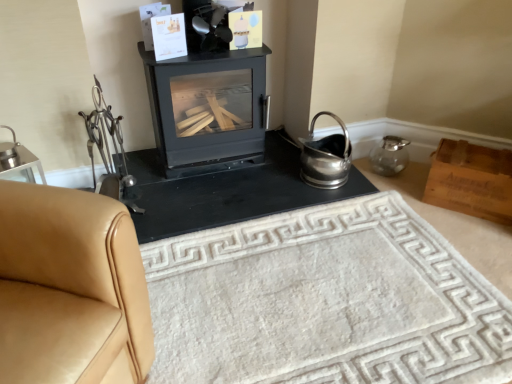
Question: Is white textured rug at center thinner than black matte fireplace at center?

Choices:
 (A) yes
 (B) no

Answer: (B)

Question: Is the depth of white textured rug at center greater than that of black matte fireplace at center?

Choices:
 (A) no
 (B) yes

Answer: (A)

Question: Would you say white textured rug at center contains black matte fireplace at center?

Choices:
 (A) no
 (B) yes

Answer: (A)

Question: From the image's perspective, is white textured rug at center located beneath black matte fireplace at center?

Choices:
 (A) no
 (B) yes

Answer: (B)

Question: From a real-world perspective, is white textured rug at center physically below black matte fireplace at center?

Choices:
 (A) no
 (B) yes

Answer: (B)

Question: Is white textured rug at center placed right next to black matte fireplace at center?

Choices:
 (A) yes
 (B) no

Answer: (B)

Question: Can you confirm if black matte fireplace at center is bigger than white textured rug at center?

Choices:
 (A) yes
 (B) no

Answer: (B)

Question: Considering the relative positions of black matte fireplace at center and white textured rug at center in the image provided, is black matte fireplace at center to the right of white textured rug at center from the viewer's perspective?

Choices:
 (A) yes
 (B) no

Answer: (B)

Question: From the image's perspective, does black matte fireplace at center appear lower than white textured rug at center?

Choices:
 (A) yes
 (B) no

Answer: (B)

Question: From the image's perspective, is black matte fireplace at center on top of white textured rug at center?

Choices:
 (A) yes
 (B) no

Answer: (A)

Question: Could you tell me if black matte fireplace at center is facing white textured rug at center?

Choices:
 (A) no
 (B) yes

Answer: (B)

Question: Can you confirm if black matte fireplace at center is thinner than white textured rug at center?

Choices:
 (A) yes
 (B) no

Answer: (A)

Question: Is black matte fireplace at center a part of tan leather couch at left?

Choices:
 (A) yes
 (B) no

Answer: (B)